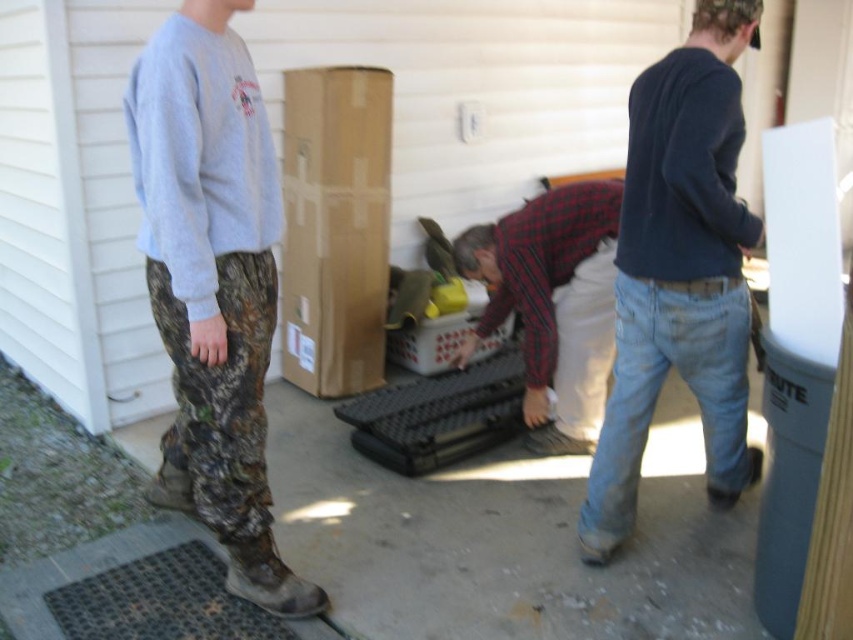
You are a photographer trying to capture a group photo of the camo pants at left and dark blue sweater at center. If you want to ensure both subjects are in focus, which one should you adjust your camera focus to prioritize based on their sizes?

The camo pants at left is narrower than the dark blue sweater at center, so you should prioritize focusing on the camo pants at left since smaller subjects require more precise focus to ensure clarity.